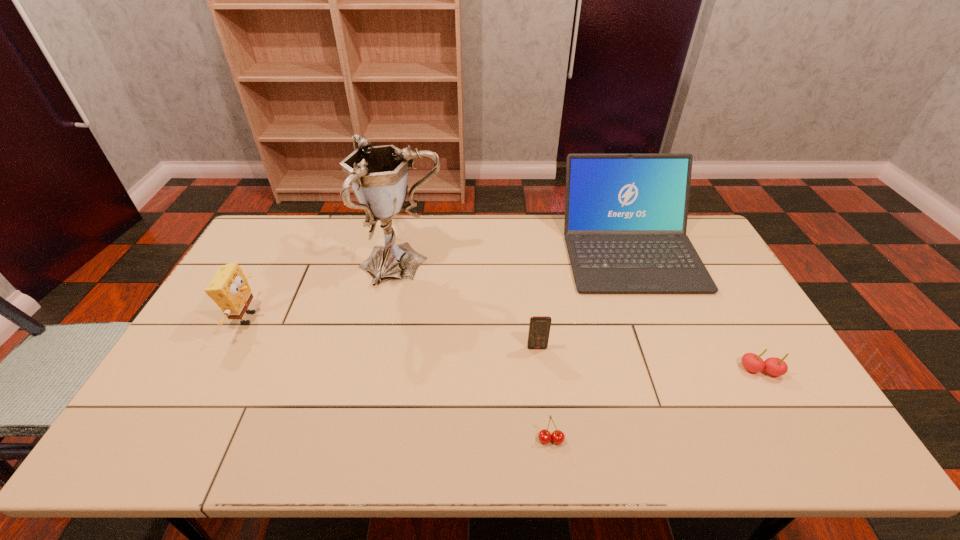
Find the location of `vacant area that satisfies the following two spatial constraints: 1. on the face of the sponge; 2. on the left side of the farther cherry`. vacant area that satisfies the following two spatial constraints: 1. on the face of the sponge; 2. on the left side of the farther cherry is located at coordinates (220, 370).

Locate an element on the screen. The height and width of the screenshot is (540, 960). vacant region that satisfies the following two spatial constraints: 1. on the screen of the right cherry; 2. on the left side of the cellular telephone is located at coordinates (540, 370).